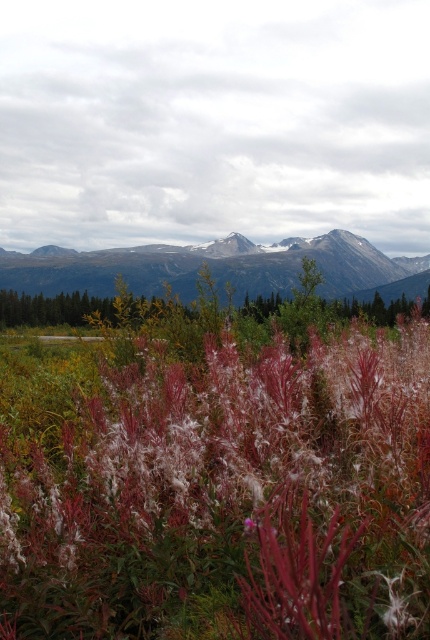
You are a botanist studying plant growth patterns in mountainous regions. You observe the fuzzy pink plant at center and the rocky gray mountains at center in the image. Which object takes up more area in the scene?

The rocky gray mountains at center occupy more area than the fuzzy pink plant at center in the scene.

You are hiking in this landscape and want to take a photo of both the fuzzy pink plant at center and the rocky gray mountains at center. Which object should you position closer to the left side of your camera frame?

You should position the fuzzy pink plant at center closer to the left side of your camera frame because the fuzzy pink plant at center is already to the left of rocky gray mountains at center in the scene.

You are a hiker planning to take a photo of the fuzzy pink plant at center and the rocky gray mountains at center. Based on their positions, which object should you focus on first to ensure both are in the frame?

The fuzzy pink plant at center is positioned under rocky gray mountains at center, so you should focus on the fuzzy pink plant at center first to ensure both are in the frame.